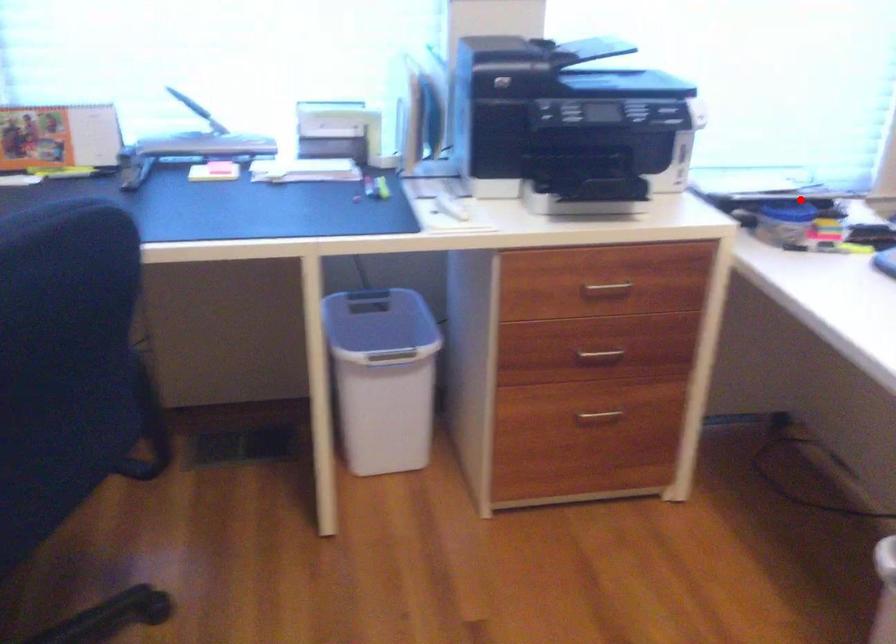
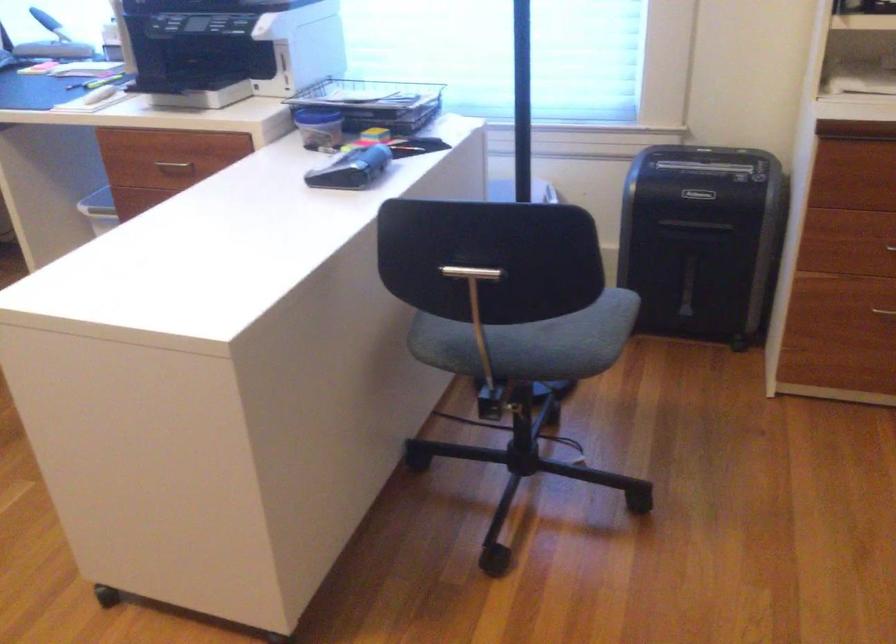
In the second image, find the point that corresponds to the highlighted location in the first image.

(374, 102)